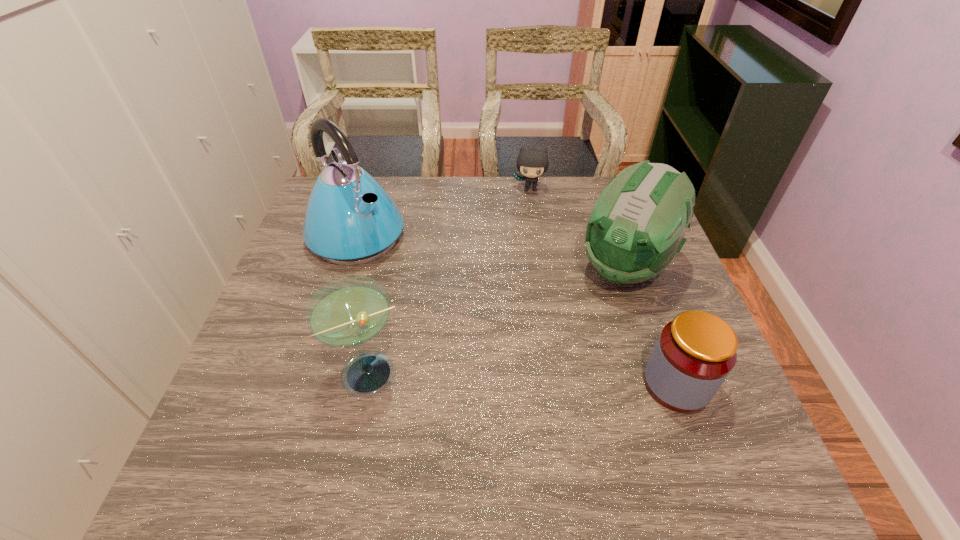
This screenshot has height=540, width=960. In the image, there is a desktop. What are the coordinates of `free space at the near right corner` in the screenshot? It's located at (669, 413).

At what (x,y) coordinates should I click in order to perform the action: click on free space between the tallest object and the fourth tallest object. Please return your answer as a coordinate pair (x, y). Looking at the image, I should click on point(516,310).

You are a GUI agent. You are given a task and a screenshot of the screen. Output one action in this format:
    pyautogui.click(x=<x>, y=<y>)
    Task: Click on the free spot between the football helmet and the kettle
    The image size is (960, 540).
    Given the screenshot: What is the action you would take?
    pyautogui.click(x=492, y=252)

You are a GUI agent. You are given a task and a screenshot of the screen. Output one action in this format:
    pyautogui.click(x=<x>, y=<y>)
    Task: Click on the free space between the kettle and the fourth shortest object
    Image resolution: width=960 pixels, height=540 pixels.
    Given the screenshot: What is the action you would take?
    pyautogui.click(x=492, y=252)

You are a GUI agent. You are given a task and a screenshot of the screen. Output one action in this format:
    pyautogui.click(x=<x>, y=<y>)
    Task: Click on the vacant point located between the fourth shortest object and the farthest object
    
    Given the screenshot: What is the action you would take?
    pos(578,228)

The height and width of the screenshot is (540, 960). In order to click on free space between the jar and the martini in this screenshot , I will do `click(524, 379)`.

Identify the location of vacant space that's between the tallest object and the football helmet. The image size is (960, 540). (492, 252).

Image resolution: width=960 pixels, height=540 pixels. I want to click on free point between the kitten and the second tallest object, so click(x=578, y=228).

Find the location of `empty space that is in between the farthest object and the third shortest object`. empty space that is in between the farthest object and the third shortest object is located at coordinates pos(450,281).

Image resolution: width=960 pixels, height=540 pixels. Find the location of `free area in between the jar and the shortest object`. free area in between the jar and the shortest object is located at coordinates (603, 287).